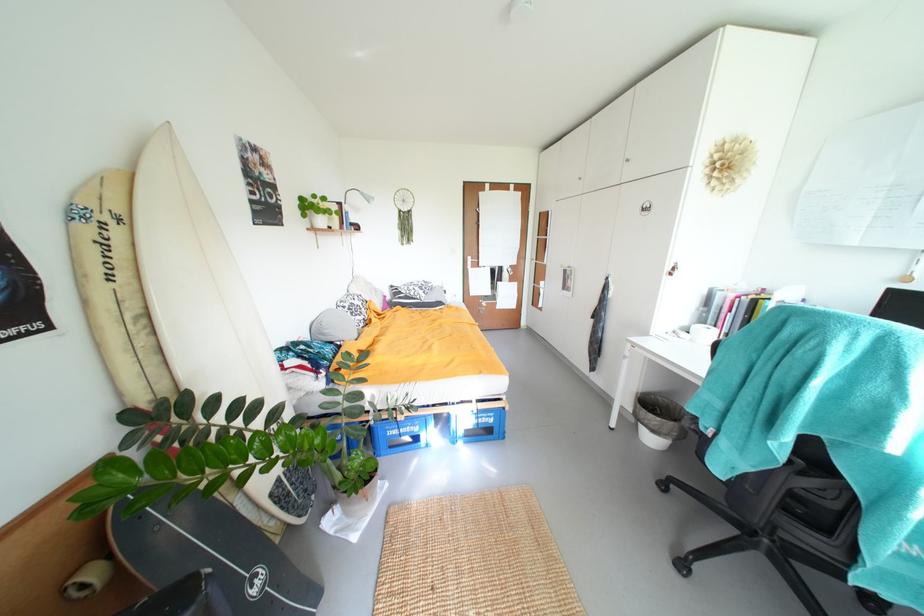
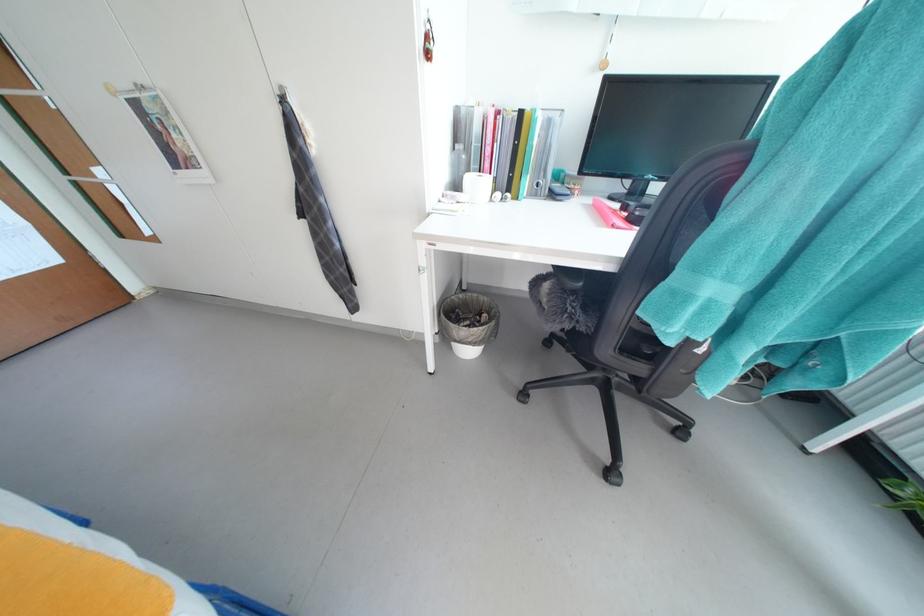
Locate, in the second image, the point that corresponds to the point at 675,270 in the first image.

(428, 41)